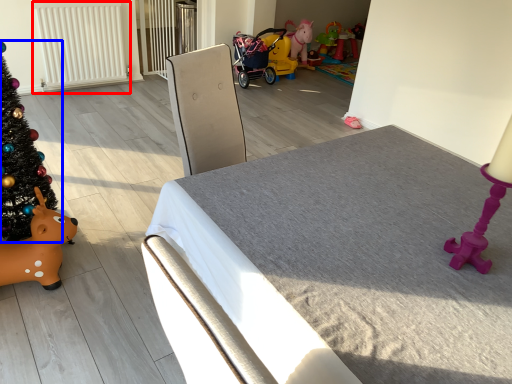
Question: Which object is further to the camera taking this photo, radiator (highlighted by a red box) or christmas tree (highlighted by a blue box)?

Choices:
 (A) radiator
 (B) christmas tree

Answer: (A)